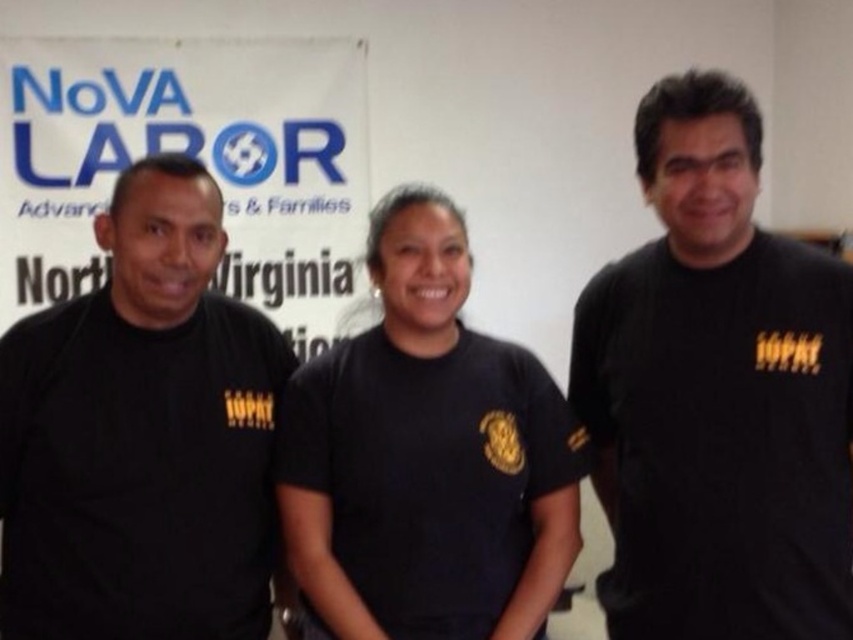
Question: Is black matte t-shirt at left closer to the viewer compared to black matte shirt at center?

Choices:
 (A) no
 (B) yes

Answer: (B)

Question: Which object is closer to the camera taking this photo?

Choices:
 (A) black matte shirt at center
 (B) black matte t-shirt at left

Answer: (B)

Question: Is black matte t-shirt at center to the right of black matte t-shirt at left from the viewer's perspective?

Choices:
 (A) yes
 (B) no

Answer: (A)

Question: Among these points, which one is nearest to the camera?

Choices:
 (A) (454, 406)
 (B) (827, 452)

Answer: (B)

Question: Which object is positioned closest to the black matte shirt at center?

Choices:
 (A) black matte t-shirt at center
 (B) black matte t-shirt at left

Answer: (B)

Question: Observing the image, what is the correct spatial positioning of black matte t-shirt at left in reference to black matte shirt at center?

Choices:
 (A) left
 (B) right

Answer: (A)